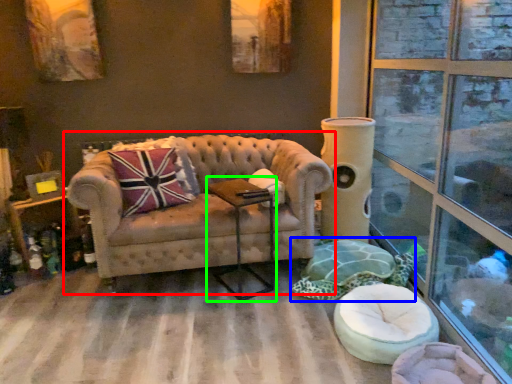
Question: Which object is the farthest from studio couch (highlighted by a red box)? Choose among these: swivel chair (highlighted by a blue box) or side table (highlighted by a green box).

Choices:
 (A) swivel chair
 (B) side table

Answer: (A)